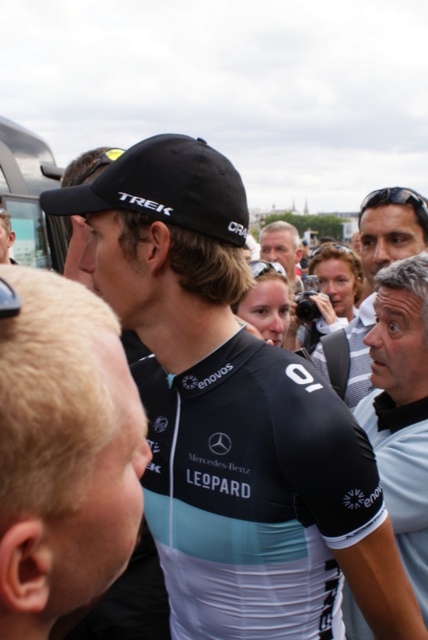
Question: Does black jersey at center have a smaller size compared to gray fabric shirt at right?

Choices:
 (A) yes
 (B) no

Answer: (A)

Question: From the image, what is the correct spatial relationship of black matte jersey at center in relation to light brown hair at center?

Choices:
 (A) above
 (B) below

Answer: (B)

Question: Which of the following is the farthest from the observer?

Choices:
 (A) (183, 564)
 (B) (383, 244)
 (C) (278, 228)

Answer: (C)

Question: Is matte black camera at center closer to the viewer compared to light brown hair at center?

Choices:
 (A) yes
 (B) no

Answer: (A)

Question: Which of the following is the closest to the observer?

Choices:
 (A) (285, 225)
 (B) (148, 260)
 (C) (53, 488)
 (D) (383, 371)

Answer: (C)

Question: Which object is positioned farthest from the gray fabric shirt at right?

Choices:
 (A) black jersey at center
 (B) light brown hair at center
 (C) black matte jersey at center

Answer: (B)